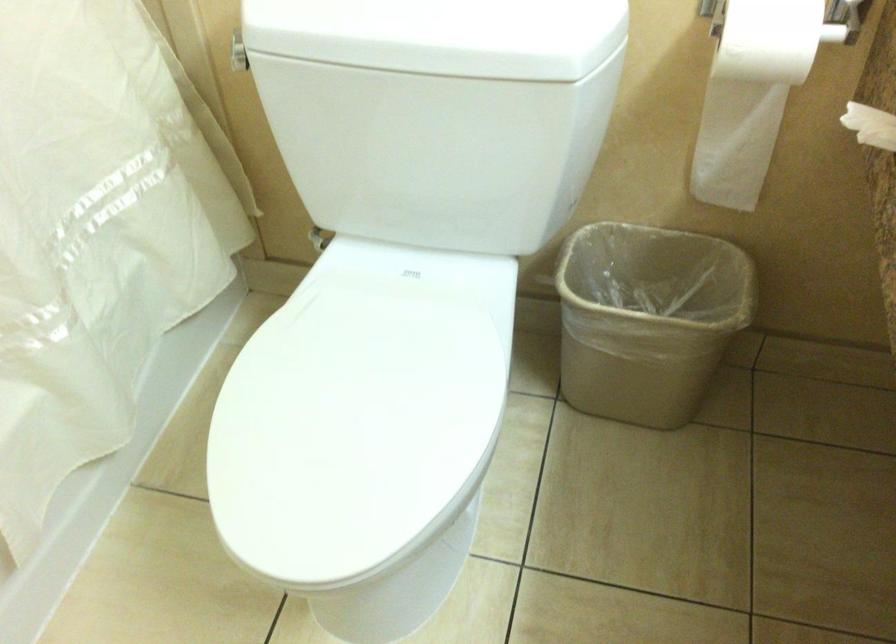
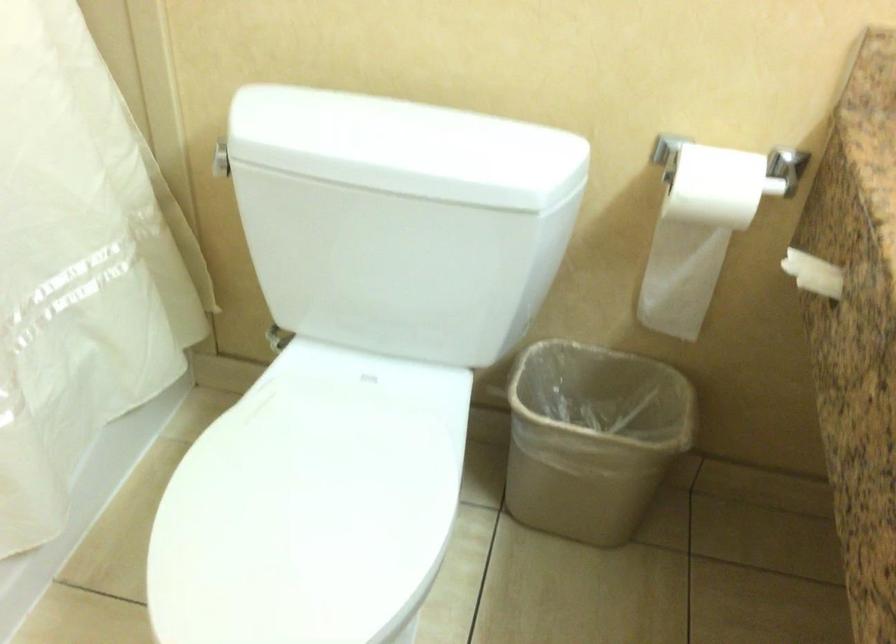
Question: Based on the continuous images, in which direction is the camera rotating? Reply with the corresponding letter.

Choices:
 (A) Left
 (B) Right
 (C) Up
 (D) Down

Answer: (C)